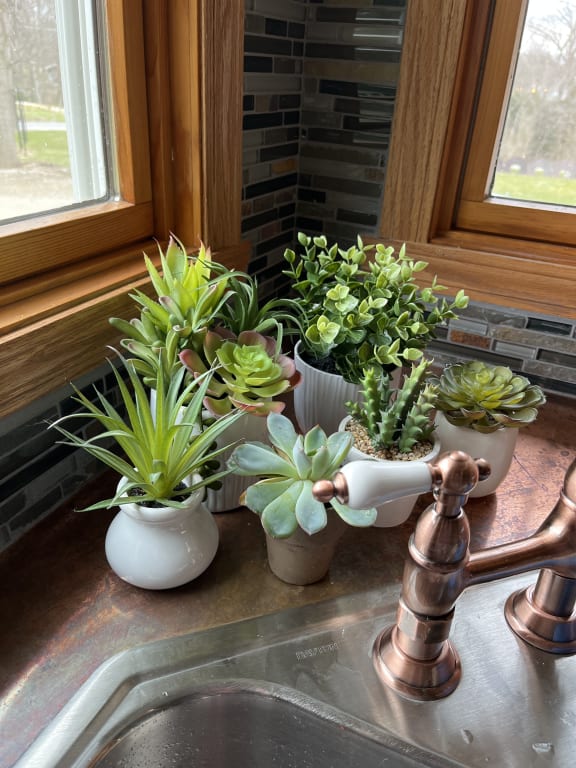
Where is `left window`? left window is located at coordinates (22, 134).